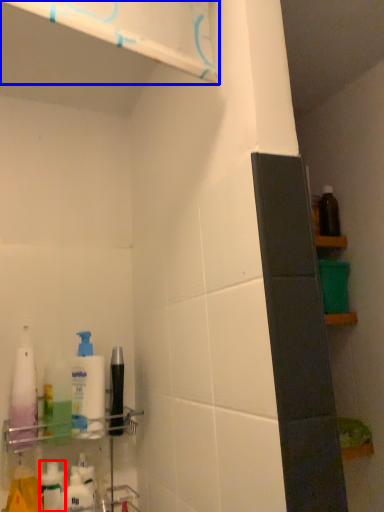
Question: Which of the following is the farthest to the observer, toiletry (highlighted by a red box) or shelf (highlighted by a blue box)?

Choices:
 (A) toiletry
 (B) shelf

Answer: (A)